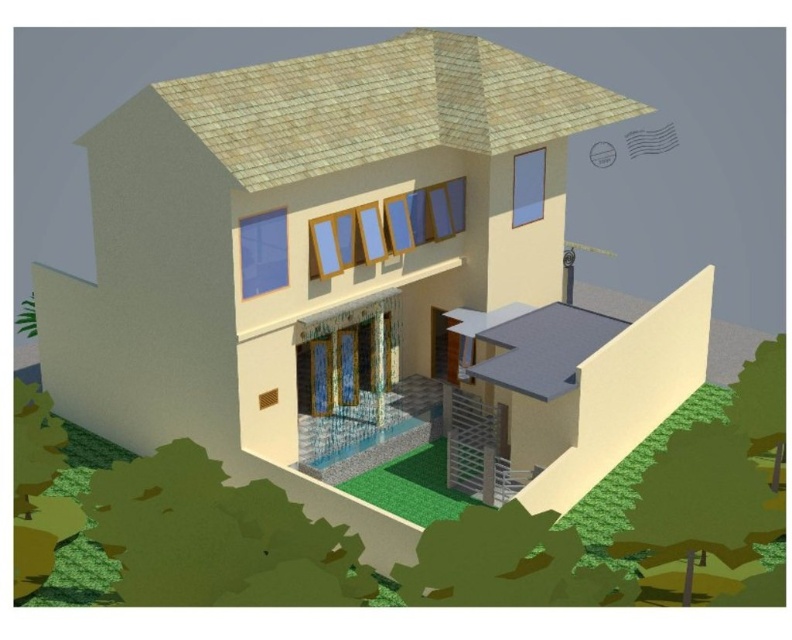
Does matte gray mailbox at upper right have a larger size compared to matte gray chimney at upper right?

Indeed, matte gray mailbox at upper right has a larger size compared to matte gray chimney at upper right.

Does matte gray mailbox at upper right appear on the right side of matte gray chimney at upper right?

Indeed, matte gray mailbox at upper right is positioned on the right side of matte gray chimney at upper right.

Who is more forward, (631, 150) or (596, 161)?

Point (596, 161)

Where is `matte gray mailbox at upper right`? matte gray mailbox at upper right is located at coordinates (650, 140).